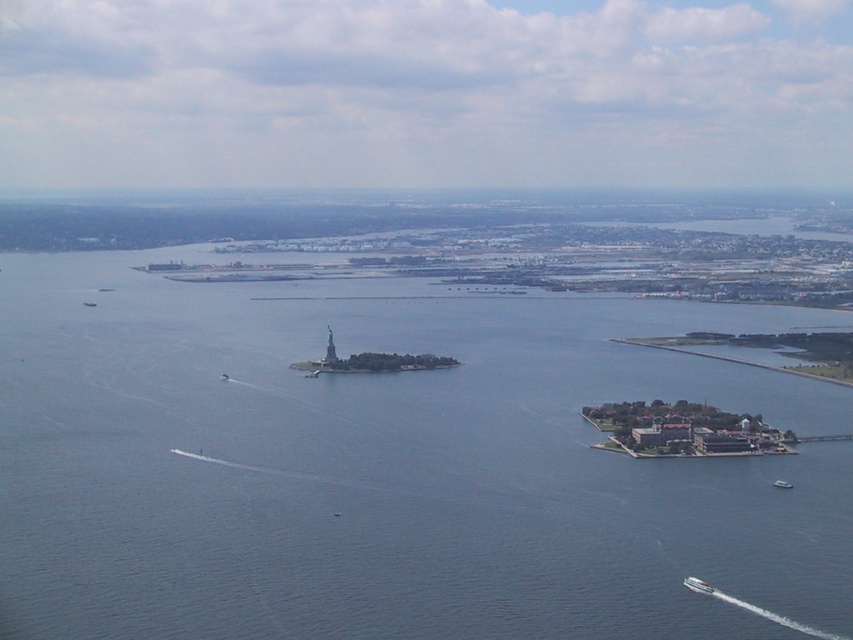
You are a drone operator tasked with capturing aerial footage of the coastal area. Your camera is currently positioned above the point labeled as point [392,467]. What is the immediate environment you are filming?

The point [392,467] corresponds to blue water at center, so the immediate environment being filmed is the blue water at center.

You are a photographer planning to capture a shot of the Statue of Liberty on the smaller island. You notice two boats in the lower right corner of your frame. Which boat, the white glossy boat at lower right or the white plastic boat at lower right, is positioned closer to the base of the Statue of Liberty?

The white glossy boat at lower right is positioned closer to the base of the Statue of Liberty because it is located below the white plastic boat at lower right, indicating it is further down towards the lower part of the image where the statue is situated.